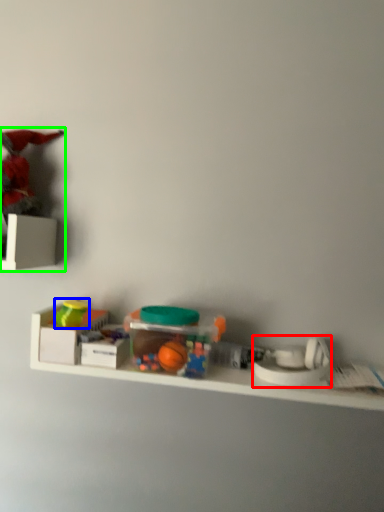
Question: Which object is the farthest from toy (highlighted by a red box)? Choose among these: toy (highlighted by a blue box) or toy (highlighted by a green box).

Choices:
 (A) toy
 (B) toy

Answer: (B)